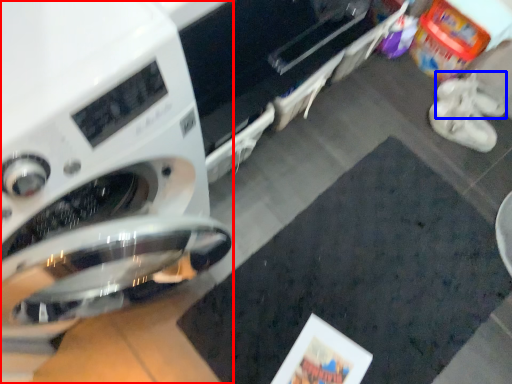
Question: Which of the following is the closest to the observer, washing machine (highlighted by a red box) or shoe (highlighted by a blue box)?

Choices:
 (A) washing machine
 (B) shoe

Answer: (A)